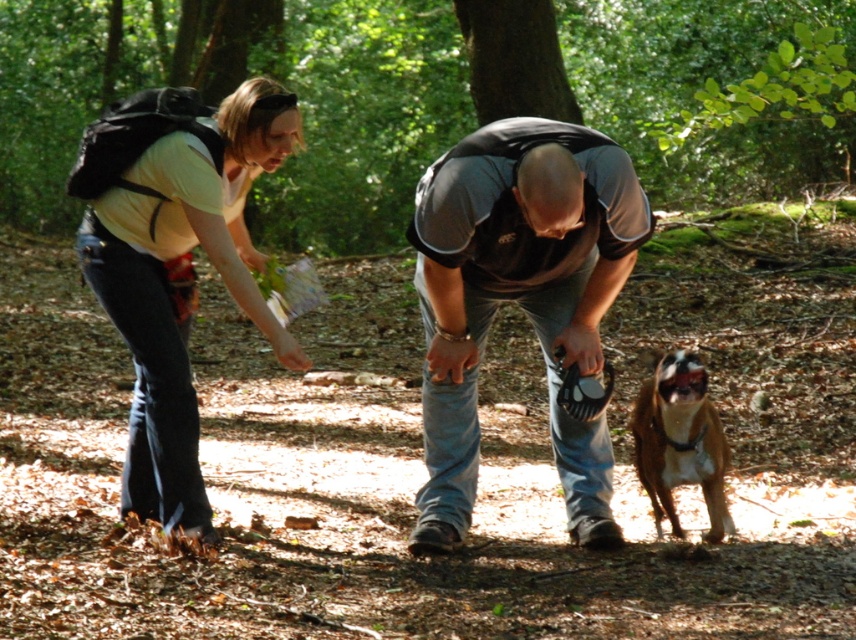
You are navigating a forest trail and see the dark gray mesh shirt at center. Based on the coordinates provided, can you determine if this person is positioned to the left or right of the center point of the image?

The dark gray mesh shirt at center is located at point (520, 300), which places it near the center of the image. Since the coordinates are close to 0.5 in both x and y axes, the person is positioned very close to the center point of the image.

You are a hiker trying to navigate through the forest. You see two points marked on your map at coordinates point (450, 381) and point (293, 125). Which point is closer to your current position if you are standing at the camera position?

Point (293, 125) is closer to your current position because it is nearer to the camera than point (450, 381).